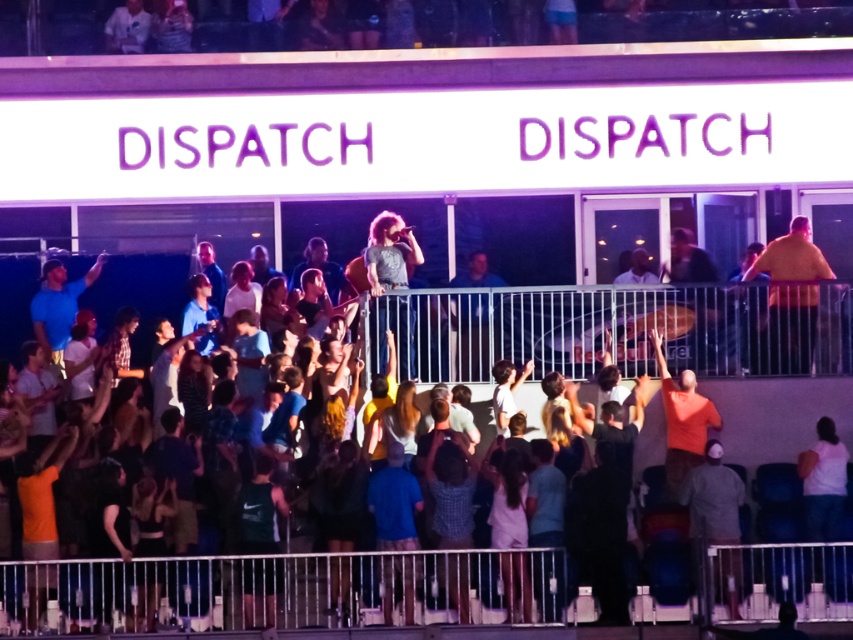
Does matte gray shirt at upper center have a greater height compared to silver metallic rail at lower center?

Indeed, matte gray shirt at upper center has a greater height compared to silver metallic rail at lower center.

Does matte gray shirt at upper center have a larger size compared to silver metallic rail at lower center?

Indeed, matte gray shirt at upper center has a larger size compared to silver metallic rail at lower center.

Is point (67, 625) positioned in front of point (361, 602)?

Yes, it is.

The width and height of the screenshot is (853, 640). Identify the location of matte gray shirt at upper center. (294, 582).

Does matte gray shirt at upper center lie in front of dark gray t-shirt at center?

Yes.

Which is in front, point (323, 620) or point (389, 264)?

Point (323, 620) is in front.

The width and height of the screenshot is (853, 640). What do you see at coordinates (294, 582) in the screenshot? I see `matte gray shirt at upper center` at bounding box center [294, 582].

Where is `matte gray shirt at upper center`? Image resolution: width=853 pixels, height=640 pixels. matte gray shirt at upper center is located at coordinates (294, 582).

Does metallic silver rail at upper center have a lesser width compared to orange cotton shirt at right?

In fact, metallic silver rail at upper center might be wider than orange cotton shirt at right.

Is metallic silver rail at upper center above orange cotton shirt at right?

No, metallic silver rail at upper center is not above orange cotton shirt at right.

This screenshot has height=640, width=853. What do you see at coordinates (618, 330) in the screenshot? I see `metallic silver rail at upper center` at bounding box center [618, 330].

You are a GUI agent. You are given a task and a screenshot of the screen. Output one action in this format:
    pyautogui.click(x=<x>, y=<y>)
    Task: Click on the metallic silver rail at upper center
    The height and width of the screenshot is (640, 853).
    Given the screenshot: What is the action you would take?
    pyautogui.click(x=618, y=330)